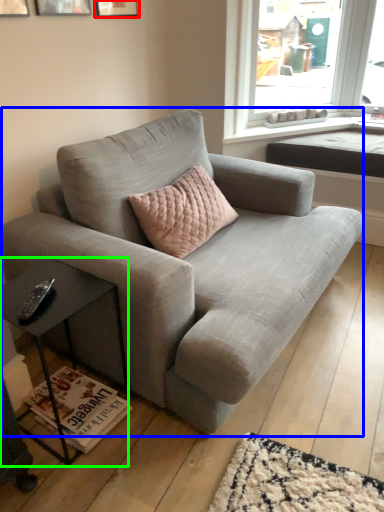
Question: Considering the real-world distances, which object is farthest from picture frame (highlighted by a red box)? studio couch (highlighted by a blue box) or table (highlighted by a green box)?

Choices:
 (A) studio couch
 (B) table

Answer: (B)